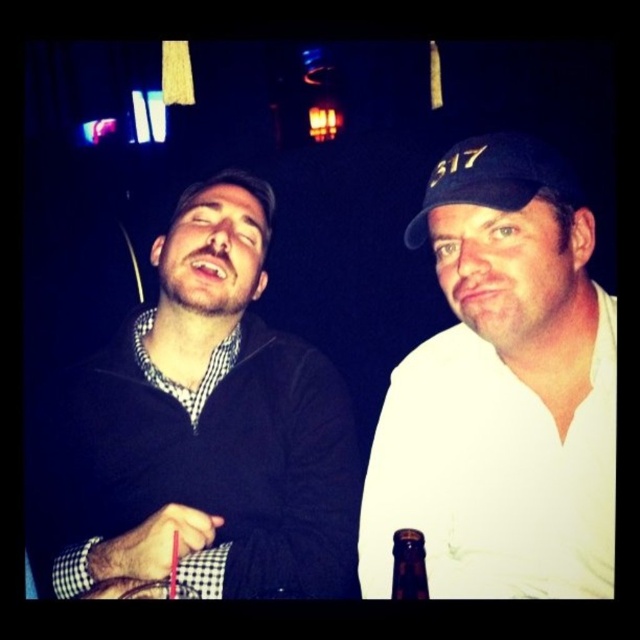
Question: Which of the following is the closest to the observer?

Choices:
 (A) (422, 582)
 (B) (266, 372)

Answer: (A)

Question: Does white matte cap at upper right appear under brown glass bottle at lower center?

Choices:
 (A) no
 (B) yes

Answer: (A)

Question: In this image, where is black matte sweater at center located relative to white matte cap at upper right?

Choices:
 (A) right
 (B) left

Answer: (B)

Question: Is the position of black matte sweater at center more distant than that of white matte cap at upper right?

Choices:
 (A) no
 (B) yes

Answer: (A)

Question: Which is nearer to the white matte cap at upper right?

Choices:
 (A) brown glass bottle at lower center
 (B) black fabric cap at upper right

Answer: (B)

Question: Which point is farther to the camera?

Choices:
 (A) (588, 445)
 (B) (420, 536)

Answer: (A)